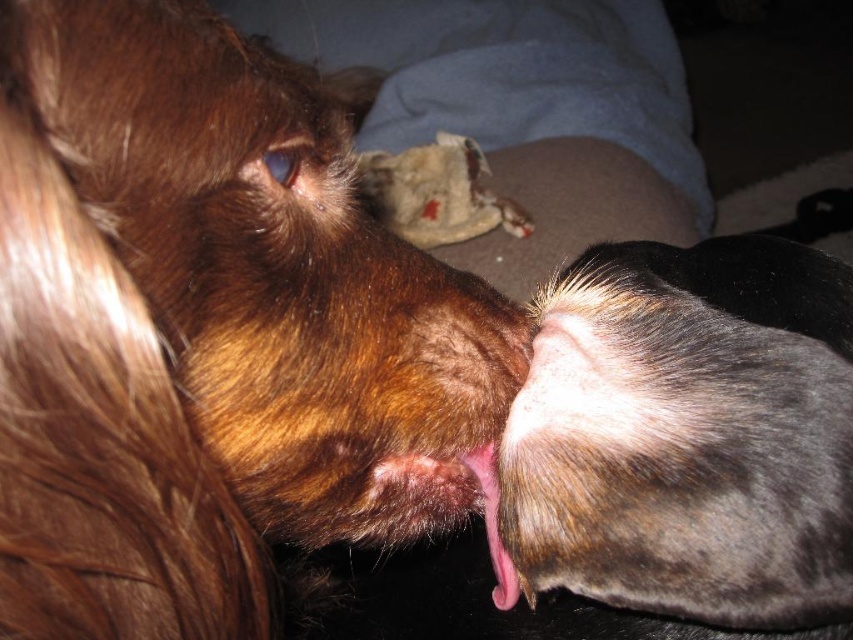
Question: Observing the image, what is the correct spatial positioning of brown furry dog at upper left in reference to pink flesh at center?

Choices:
 (A) below
 (B) above

Answer: (B)

Question: Does brown furry dog at upper left appear over pink flesh at center?

Choices:
 (A) no
 (B) yes

Answer: (B)

Question: Among these objects, which one is farthest from the camera?

Choices:
 (A) fuzzy brown dog at lower right
 (B) pink flesh at center
 (C) brown furry dog at upper left

Answer: (B)

Question: Among these points, which one is farthest from the camera?

Choices:
 (A) (683, 492)
 (B) (502, 573)

Answer: (B)

Question: Among these objects, which one is nearest to the camera?

Choices:
 (A) fuzzy brown dog at lower right
 (B) brown furry dog at upper left

Answer: (B)

Question: From the image, what is the correct spatial relationship of brown furry dog at upper left in relation to fuzzy brown dog at lower right?

Choices:
 (A) left
 (B) right

Answer: (A)